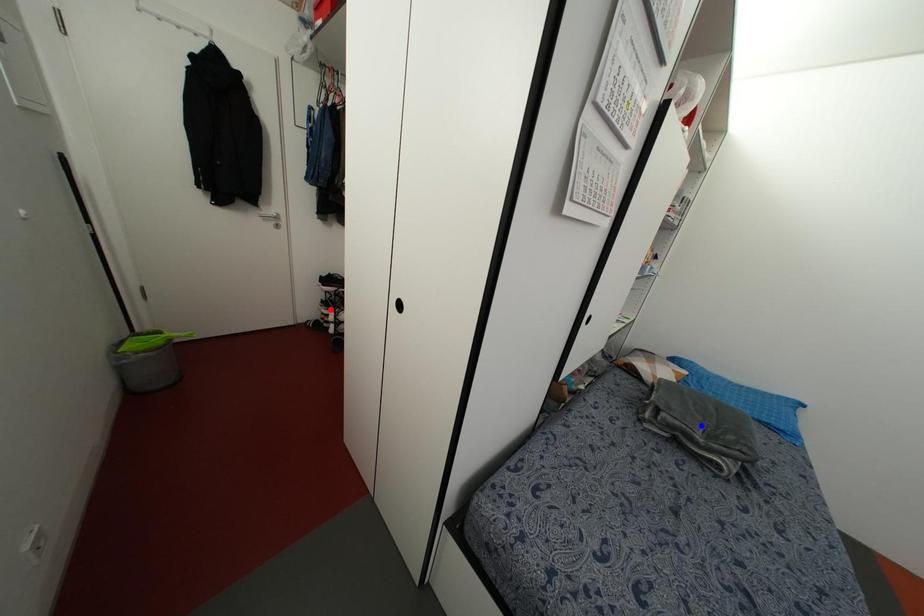
Question: Which of the two points in the image is closer to the camera?

Choices:
 (A) Blue point is closer.
 (B) Red point is closer.

Answer: (A)